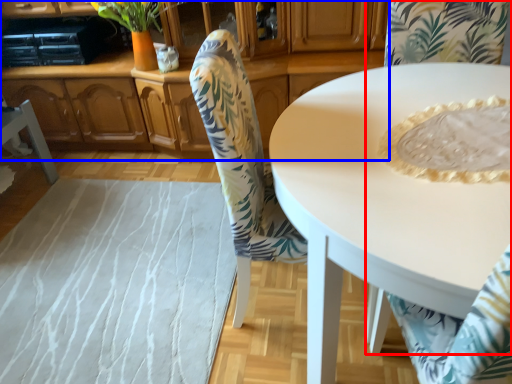
Question: Which point is closer to the camera, chair (highlighted by a red box) or cabinetry (highlighted by a blue box)?

Choices:
 (A) chair
 (B) cabinetry

Answer: (A)